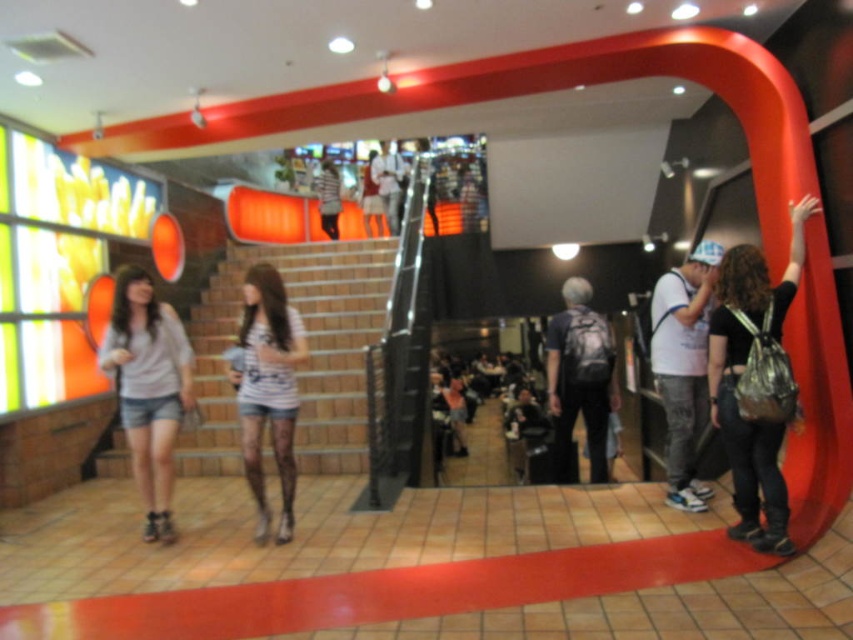
Who is higher up, white striped shirt at center or white cotton shirt at center?

Positioned higher is white cotton shirt at center.

Identify the location of white striped shirt at center. (268, 388).

I want to click on white striped shirt at center, so click(268, 388).

Can you confirm if brown brick stairs at center is shorter than white cotton shirt at center?

No.

The height and width of the screenshot is (640, 853). What are the coordinates of `brown brick stairs at center` in the screenshot? It's located at (300, 365).

The width and height of the screenshot is (853, 640). What do you see at coordinates (300, 365) in the screenshot?
I see `brown brick stairs at center` at bounding box center [300, 365].

Locate an element on the screen. The width and height of the screenshot is (853, 640). brown brick stairs at center is located at coordinates (300, 365).

Does point (764, 348) lie behind point (689, 499)?

No, (764, 348) is closer to viewer.

Who is taller, black matte backpack at right or white cotton shirt at center?

Standing taller between the two is black matte backpack at right.

In the scene shown: Measure the distance between black matte backpack at right and camera.

They are 3.31 meters apart.

The width and height of the screenshot is (853, 640). I want to click on black matte backpack at right, so (755, 381).